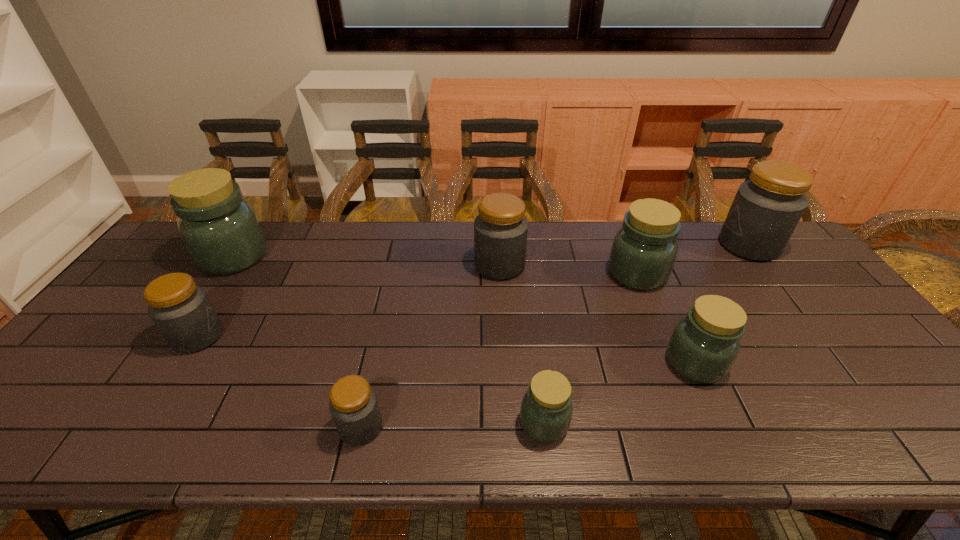
Where is `free location at the left edge of the desktop`? free location at the left edge of the desktop is located at coordinates (98, 361).

At what (x,y) coordinates should I click in order to perform the action: click on free spot at the right edge of the desktop. Please return your answer as a coordinate pair (x, y). Looking at the image, I should click on (839, 301).

At what (x,y) coordinates should I click in order to perform the action: click on unoccupied area between the nearest green jar and the leftmost green jar. Please return your answer as a coordinate pair (x, y). Looking at the image, I should click on (389, 340).

Where is `blank region between the biggest gray jar and the third biggest gray jar`? Image resolution: width=960 pixels, height=540 pixels. blank region between the biggest gray jar and the third biggest gray jar is located at coordinates (473, 291).

At what (x,y) coordinates should I click in order to perform the action: click on free space that is in between the leftmost green jar and the second biggest gray jar. Please return your answer as a coordinate pair (x, y). The image size is (960, 540). Looking at the image, I should click on (367, 261).

I want to click on free spot between the leftmost green jar and the second smallest gray jar, so click(x=216, y=296).

I want to click on free space between the rightmost object and the third farthest gray jar, so click(473, 291).

I want to click on unoccupied area between the second smallest green jar and the third gray jar from left to right, so click(597, 314).

Find the location of a particular element. vacant space that's between the leftmost green jar and the second smallest gray jar is located at coordinates (216, 296).

Find the location of `free space that is in between the second smallest gray jar and the third smallest green jar`. free space that is in between the second smallest gray jar and the third smallest green jar is located at coordinates (418, 305).